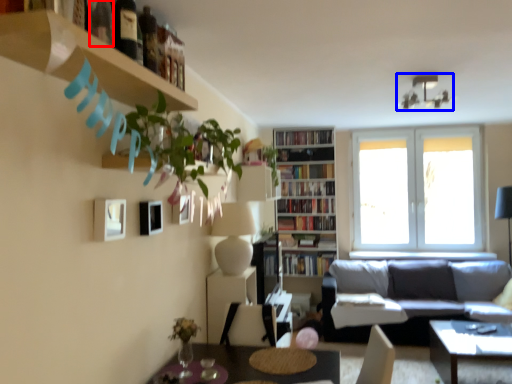
Question: Which object appears closest to the camera in this image, wine bottle (highlighted by a red box) or lamp (highlighted by a blue box)?

Choices:
 (A) wine bottle
 (B) lamp

Answer: (A)